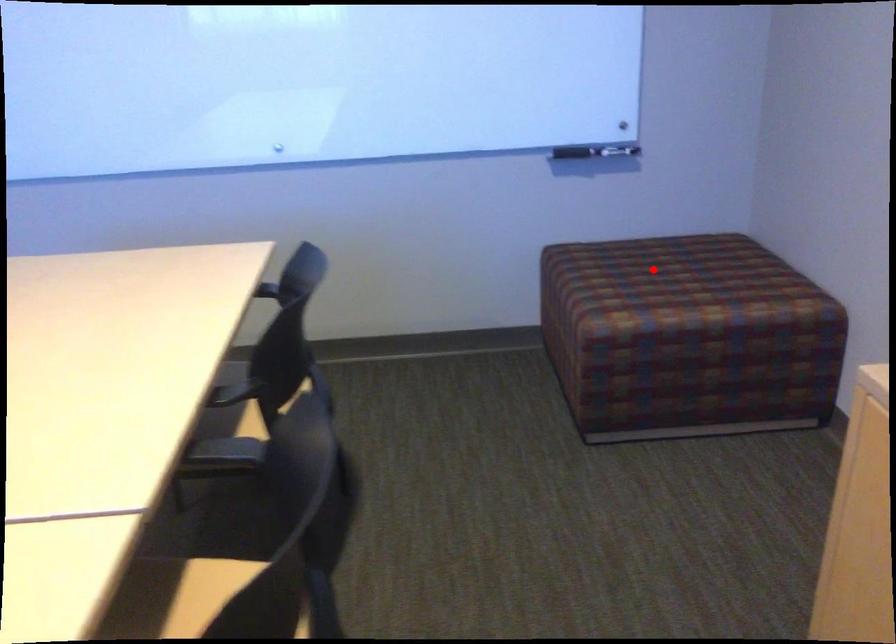
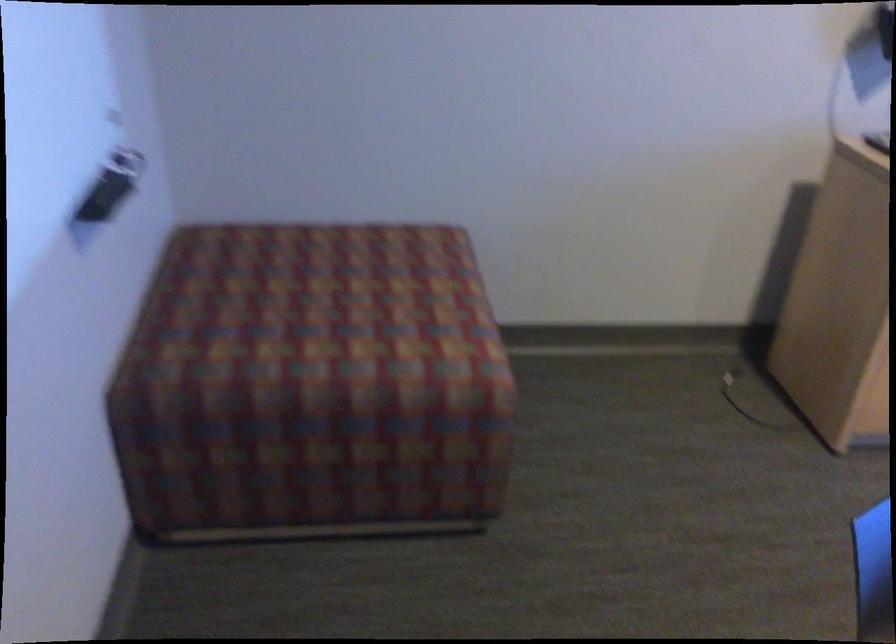
The point at the highlighted location is marked in the first image. Where is the corresponding point in the second image?

(332, 301)